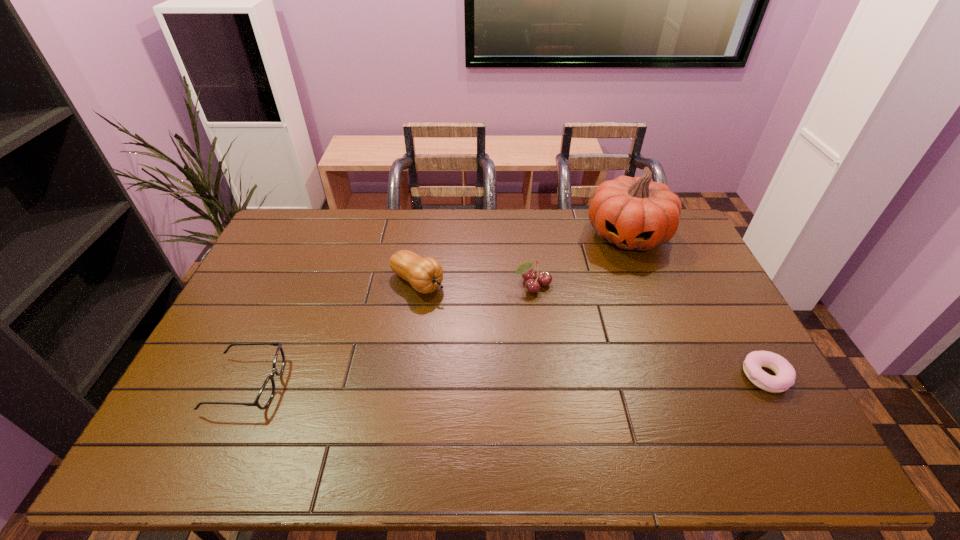
Identify the location of free location located 0.370m on the leaves of the cherry. (576, 397).

Find the location of `free region located on the leaves of the cherry`. free region located on the leaves of the cherry is located at coordinates (545, 318).

You are a GUI agent. You are given a task and a screenshot of the screen. Output one action in this format:
    pyautogui.click(x=<x>, y=<y>)
    Task: Click on the free spot located 0.260m on the face of the tallest object
    
    Given the screenshot: What is the action you would take?
    pyautogui.click(x=604, y=311)

What are the coordinates of `free space located 0.080m on the face of the tallest object` in the screenshot? It's located at click(x=615, y=275).

This screenshot has height=540, width=960. Find the location of `free space located on the face of the tallest object`. free space located on the face of the tallest object is located at coordinates (613, 280).

I want to click on blank area located on the stem side of the gourd, so click(469, 316).

You are a GUI agent. You are given a task and a screenshot of the screen. Output one action in this format:
    pyautogui.click(x=<x>, y=<y>)
    Task: Click on the free space located on the stem side of the gourd
    
    Given the screenshot: What is the action you would take?
    pyautogui.click(x=524, y=353)

Where is `vacant space located 0.230m on the stem side of the gourd`? vacant space located 0.230m on the stem side of the gourd is located at coordinates (492, 331).

Locate an element on the screen. object located at the far edge is located at coordinates (633, 213).

Find the location of a particular element. spectacles positioned at the near edge is located at coordinates (267, 391).